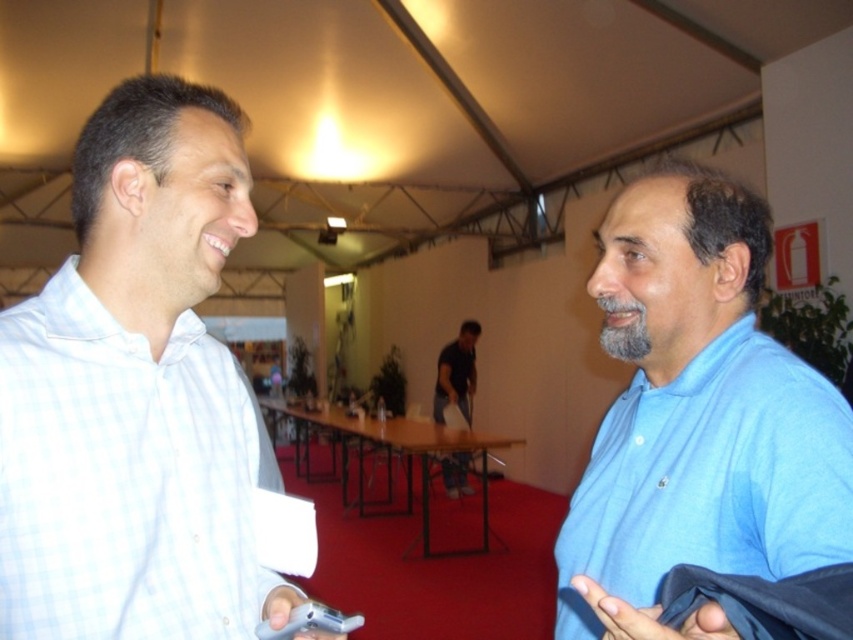
Question: Does white checkered shirt at left have a greater width compared to blue cotton shirt at right?

Choices:
 (A) no
 (B) yes

Answer: (A)

Question: Which point is farther from the camera taking this photo?

Choices:
 (A) (459, 356)
 (B) (173, 417)
 (C) (714, 193)

Answer: (A)

Question: Does blue cotton shirt at right come in front of dark blue shirt at center?

Choices:
 (A) no
 (B) yes

Answer: (B)

Question: Which object is the farthest from the white checkered shirt at left?

Choices:
 (A) blue cotton shirt at right
 (B) dark blue shirt at center

Answer: (B)

Question: Among these objects, which one is farthest from the camera?

Choices:
 (A) dark blue shirt at center
 (B) blue cotton shirt at right
 (C) white checkered shirt at left

Answer: (A)

Question: Is blue cotton shirt at right above dark blue shirt at center?

Choices:
 (A) no
 (B) yes

Answer: (B)